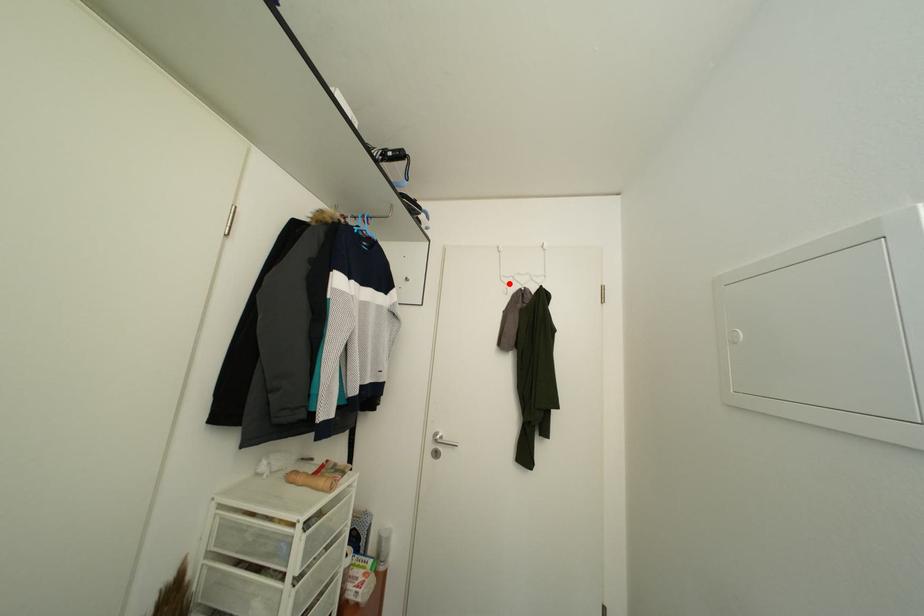
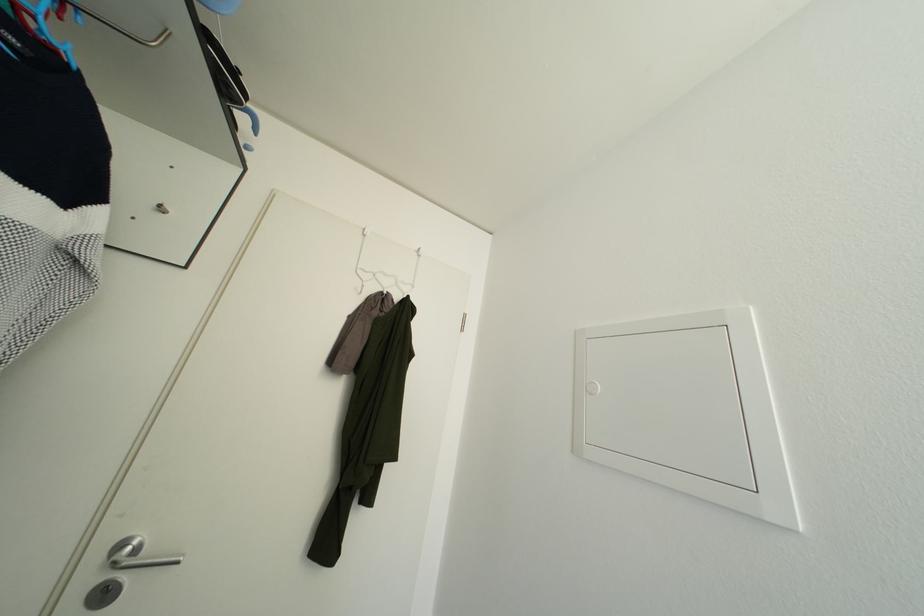
Locate, in the second image, the point that corresponds to the highlighted location in the first image.

(366, 277)